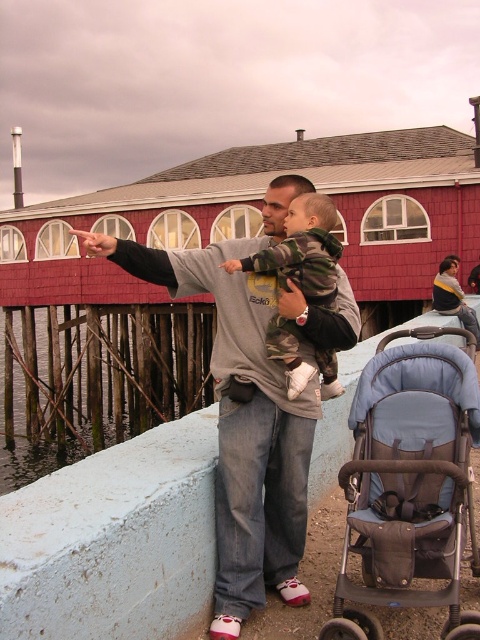
Can you confirm if blue fabric stroller at lower right is taller than camouflage fabric baby at center?

Correct, blue fabric stroller at lower right is much taller as camouflage fabric baby at center.

Does point (398, 385) come closer to viewer compared to point (324, 196)?

Yes, it is.

Does point (476, 614) come closer to viewer compared to point (278, 269)?

Yes.

You are a GUI agent. You are given a task and a screenshot of the screen. Output one action in this format:
    pyautogui.click(x=<x>, y=<y>)
    Task: Click on the blue fabric stroller at lower right
    The height and width of the screenshot is (640, 480).
    Given the screenshot: What is the action you would take?
    pyautogui.click(x=408, y=483)

Between gray cotton sweatshirt at center and clear water at lower left, which one is positioned lower?

clear water at lower left

Between gray cotton sweatshirt at center and clear water at lower left, which one appears on the left side from the viewer's perspective?

Positioned to the left is clear water at lower left.

Locate an element on the screen. This screenshot has height=640, width=480. gray cotton sweatshirt at center is located at coordinates (251, 404).

At what (x,y) coordinates should I click in order to perform the action: click on gray cotton sweatshirt at center. Please return your answer as a coordinate pair (x, y). The height and width of the screenshot is (640, 480). Looking at the image, I should click on (251, 404).

Is gray cotton sweatshirt at center to the left of camouflage fabric baby at center from the viewer's perspective?

Yes, gray cotton sweatshirt at center is to the left of camouflage fabric baby at center.

Between point (274, 556) and point (338, 394), which one is positioned in front?

Point (274, 556)

Where is `gray cotton sweatshirt at center`? The width and height of the screenshot is (480, 640). gray cotton sweatshirt at center is located at coordinates (251, 404).